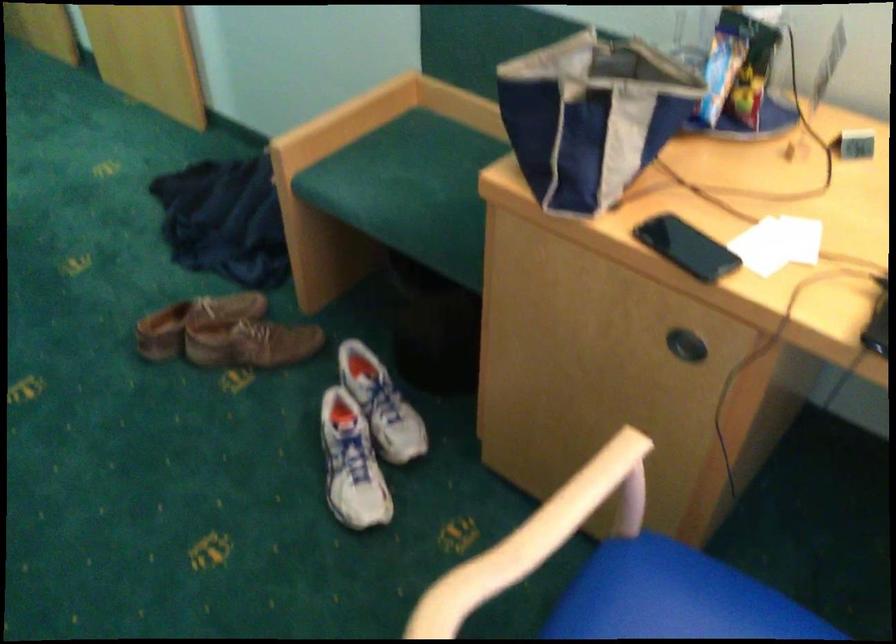
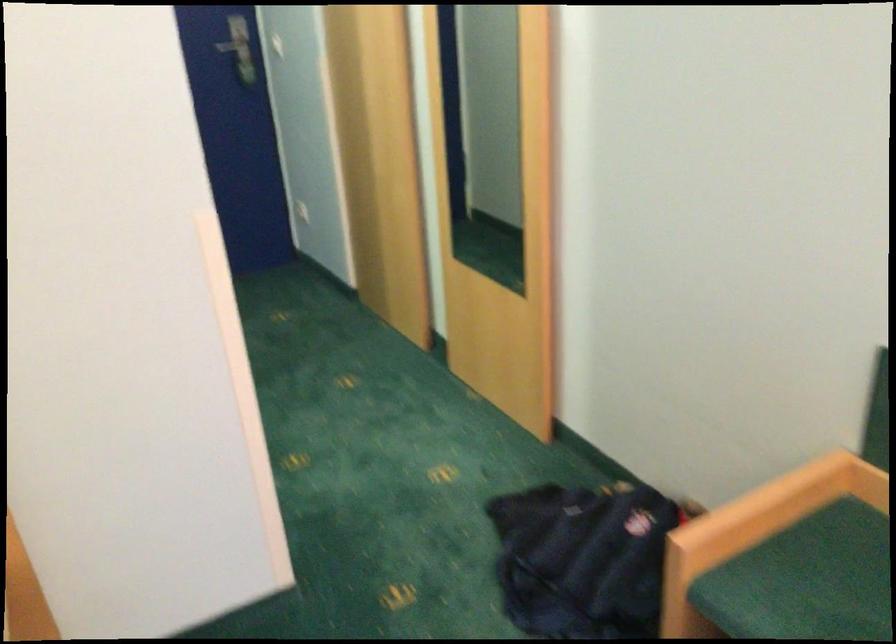
Find the pixel in the second image that matches point 342,138 in the first image.

(756, 529)